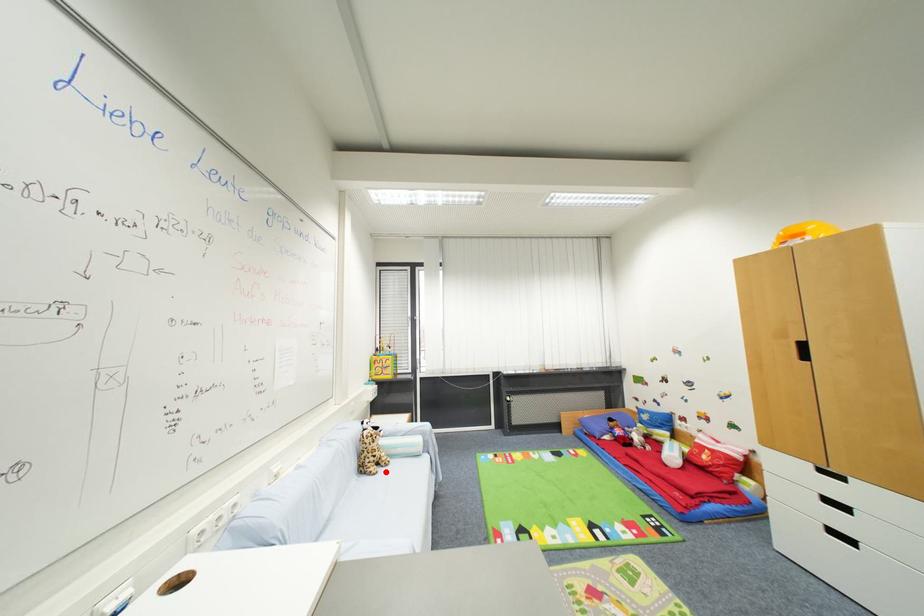
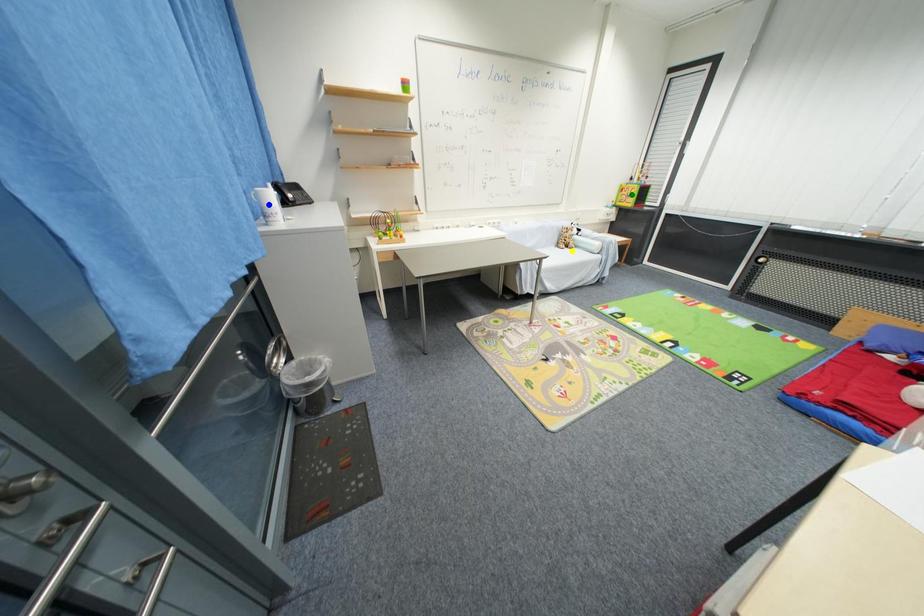
Question: I am providing you with two images of the same scene from different viewpoints. A red point is marked on the first image. You are given multiple points on the second image. In image 2, which mark is for the same physical point as the one in image 1?

Choices:
 (A) blue point
 (B) green point
 (C) yellow point

Answer: (C)